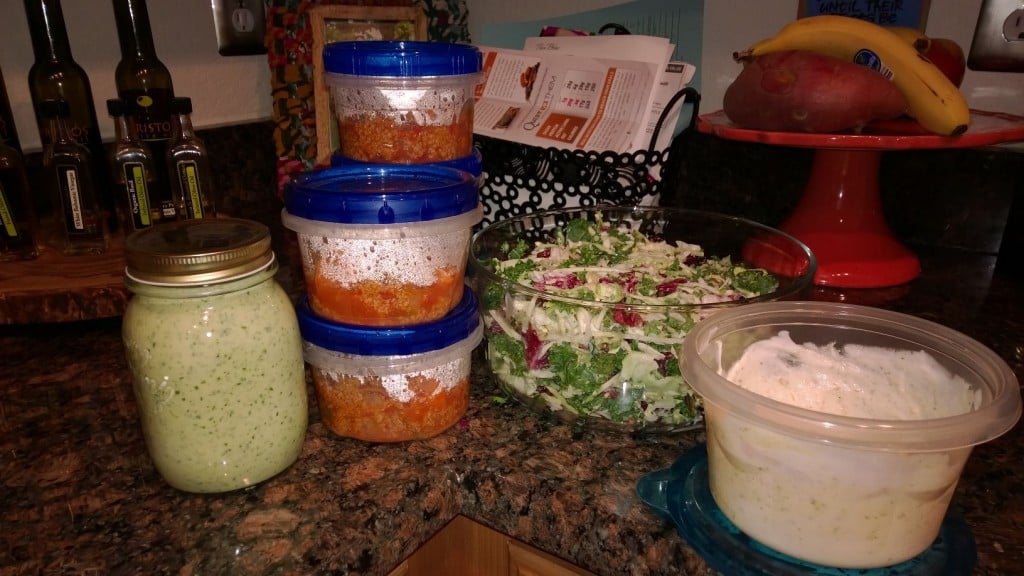
Locate an element on the screen. This screenshot has width=1024, height=576. plastic container is located at coordinates (400, 406), (380, 278), (404, 124), (787, 458).